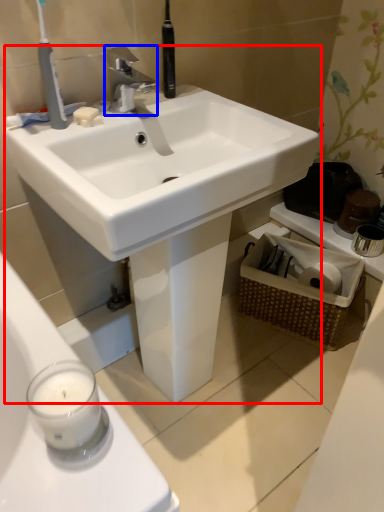
Question: Which object appears farthest to the camera in this image, sink (highlighted by a red box) or tap (highlighted by a blue box)?

Choices:
 (A) sink
 (B) tap

Answer: (B)